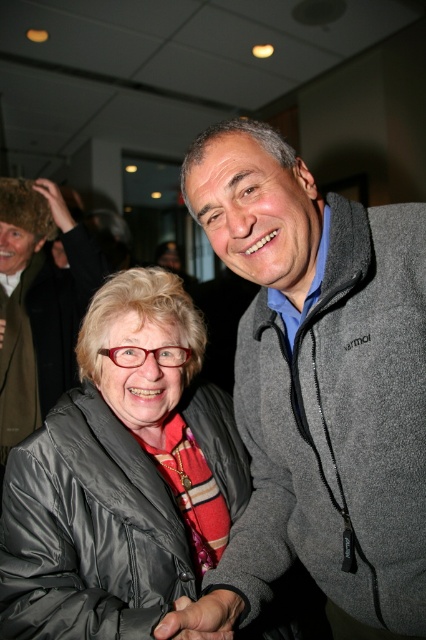
You are a photographer setting up for a group photo. You notice two jackets in the scene, the matte black jacket at center and the gray fleece jacket at upper right. Which jacket should you adjust to ensure both jackets are at the same height in the photo?

The matte black jacket at center has a lesser height compared to the gray fleece jacket at upper right. To make them the same height, adjust the matte black jacket at center to be higher in the frame.

You are standing in the hallway and see two points marked in the image. Which point is nearer to you, point (198, 611) or point (46, 360)?

Point (198, 611) is closer to the viewer than point (46, 360).